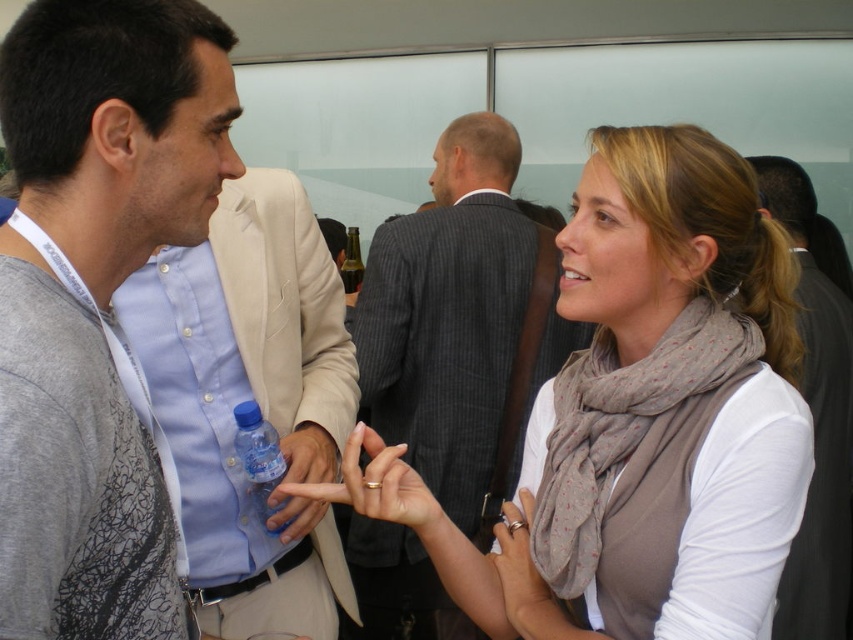
Who is taller, light blue button-down shirt at center or dark gray suit at center?

dark gray suit at center is taller.

The image size is (853, 640). Identify the location of light blue button-down shirt at center. (248, 397).

Does point (297, 252) come closer to viewer compared to point (770, 177)?

Yes, point (297, 252) is in front of point (770, 177).

At what (x,y) coordinates should I click in order to perform the action: click on light blue button-down shirt at center. Please return your answer as a coordinate pair (x, y). Looking at the image, I should click on (248, 397).

In the scene shown: Is gray pinstripe suit at center above dark gray suit at center?

Actually, gray pinstripe suit at center is below dark gray suit at center.

Which is above, gray pinstripe suit at center or dark gray suit at center?

dark gray suit at center is higher up.

Between point (427, 301) and point (813, 365), which one is positioned in front?

Point (813, 365) is in front.

Find the location of `gray pinstripe suit at center`. gray pinstripe suit at center is located at coordinates (462, 324).

Is light gray scarf at center thinner than clear glass bottle at center?

Incorrect, light gray scarf at center's width is not less than clear glass bottle at center's.

Which is below, light gray scarf at center or clear glass bottle at center?

light gray scarf at center

Which is in front, point (554, 454) or point (357, 276)?

Positioned in front is point (554, 454).

I want to click on light gray scarf at center, so click(x=640, y=417).